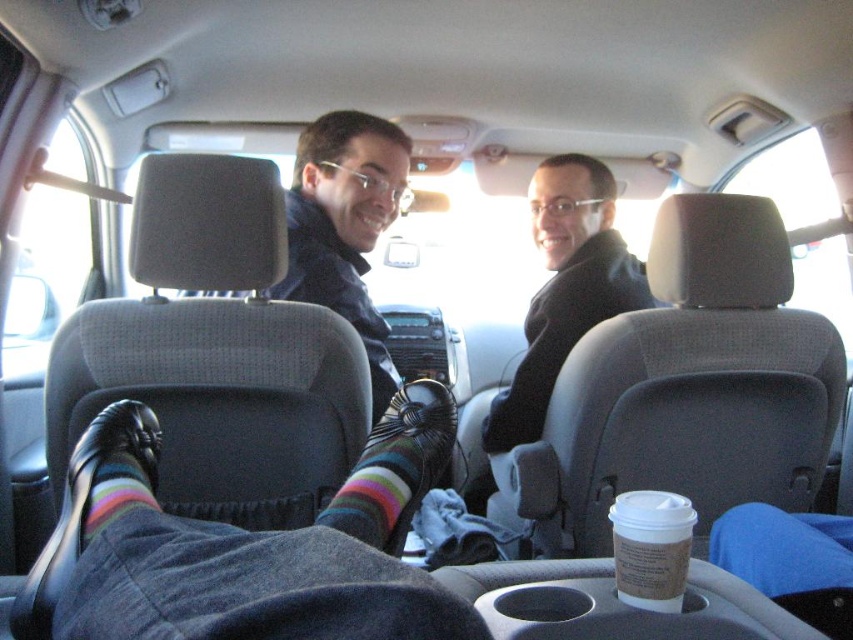
You are sitting in the backseat of the car and notice two jackets in the front. Which one is on the left side, the matte black jacket at center or the black matte jacket at center?

The matte black jacket at center is positioned on the left side of black matte jacket at center.